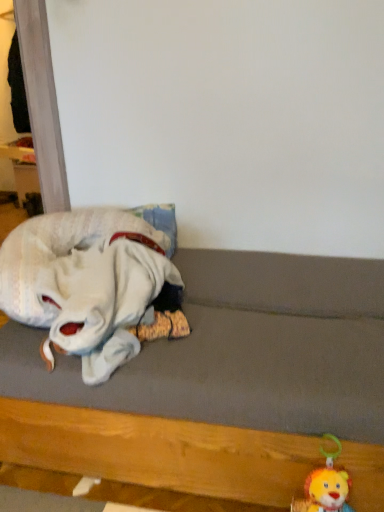
Question: From the image's perspective, is wooden bed frame at lower left located above or below white plush toy at left, the second toy viewed from the right?

Choices:
 (A) below
 (B) above

Answer: (A)

Question: In the image, is wooden bed frame at lower left on the left side or the right side of white plush toy at left, marked as the second toy in a bottom-to-top arrangement?

Choices:
 (A) right
 (B) left

Answer: (A)

Question: Based on their relative distances, which object is farther from the white plush toy at left, the second toy viewed from the right?

Choices:
 (A) wooden bed frame at lower left
 (B) fluffy plush lion at lower right, which is counted as the 2th toy, starting from the top

Answer: (B)

Question: Which is farther from the wooden bed frame at lower left?

Choices:
 (A) white plush toy at left, placed as the 1th toy when sorted from top to bottom
 (B) fluffy plush lion at lower right, which is counted as the 2th toy, starting from the top

Answer: (B)